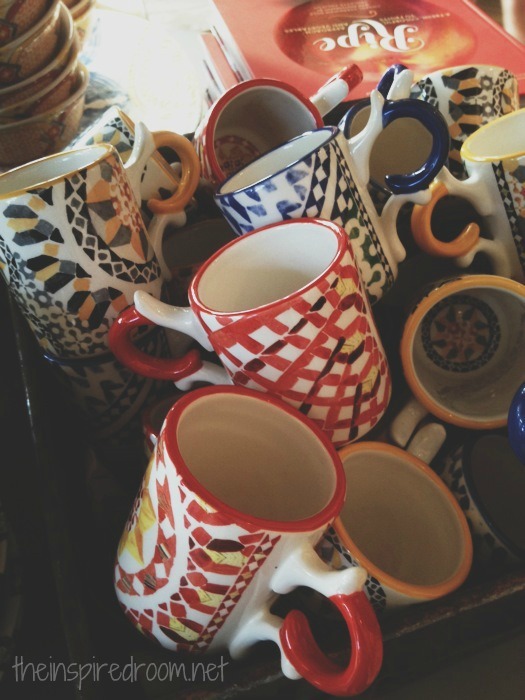
I want to click on bowls, so click(x=52, y=124), click(x=48, y=99), click(x=36, y=85), click(x=34, y=54), click(x=29, y=18).